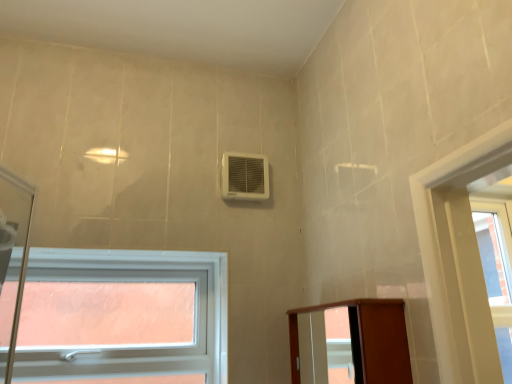
Question: Choose the correct answer: Is white plastic window at lower left inside brown wood elevator at lower right or outside it?

Choices:
 (A) inside
 (B) outside

Answer: (B)

Question: Considering their positions, is white plastic window at lower left located in front of or behind brown wood elevator at lower right?

Choices:
 (A) behind
 (B) front

Answer: (A)

Question: Which object is positioned farthest from the white plastic window at lower left?

Choices:
 (A) white plastic air conditioning unit at upper center
 (B) brown wood elevator at lower right

Answer: (B)

Question: Estimate the real-world distances between objects in this image. Which object is farther from the brown wood elevator at lower right?

Choices:
 (A) white plastic air conditioning unit at upper center
 (B) white plastic window at lower left

Answer: (B)